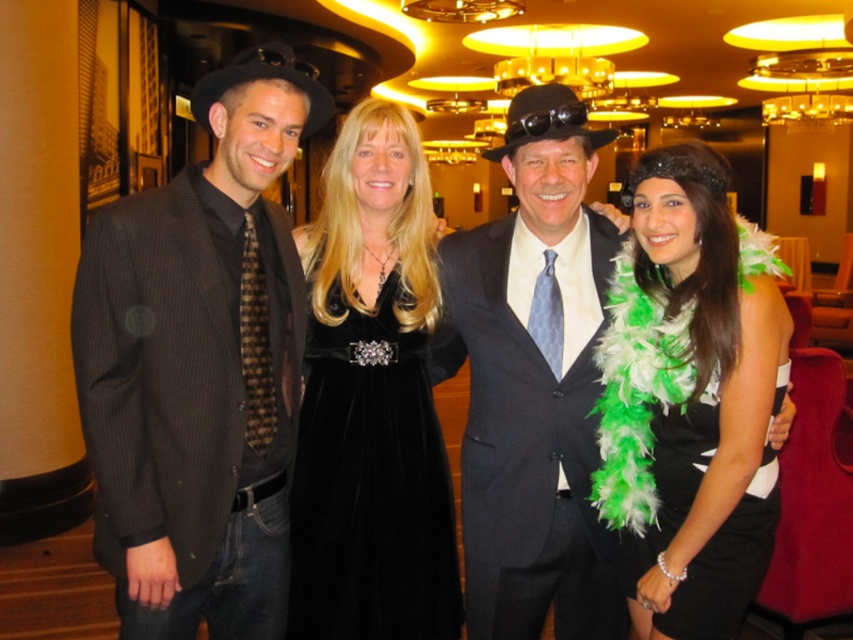
Question: Does matte black suit at left appear on the right side of matte black suit at center?

Choices:
 (A) yes
 (B) no

Answer: (B)

Question: Which object appears farthest from the camera in this image?

Choices:
 (A) white feather boa at center
 (B) dark gray wool suit at center

Answer: (B)

Question: Does matte black suit at left have a greater width compared to white feather boa at center?

Choices:
 (A) no
 (B) yes

Answer: (B)

Question: Does white feather boa at center have a larger size compared to velvet black dress at center?

Choices:
 (A) yes
 (B) no

Answer: (A)

Question: Which point is closer to the camera?

Choices:
 (A) dark gray wool suit at center
 (B) matte black suit at center
 (C) white feather boa at center

Answer: (C)

Question: Which point is closer to the camera?

Choices:
 (A) white feather boa at center
 (B) matte black suit at center
 (C) dark gray wool suit at center
 (D) matte black suit at left

Answer: (D)